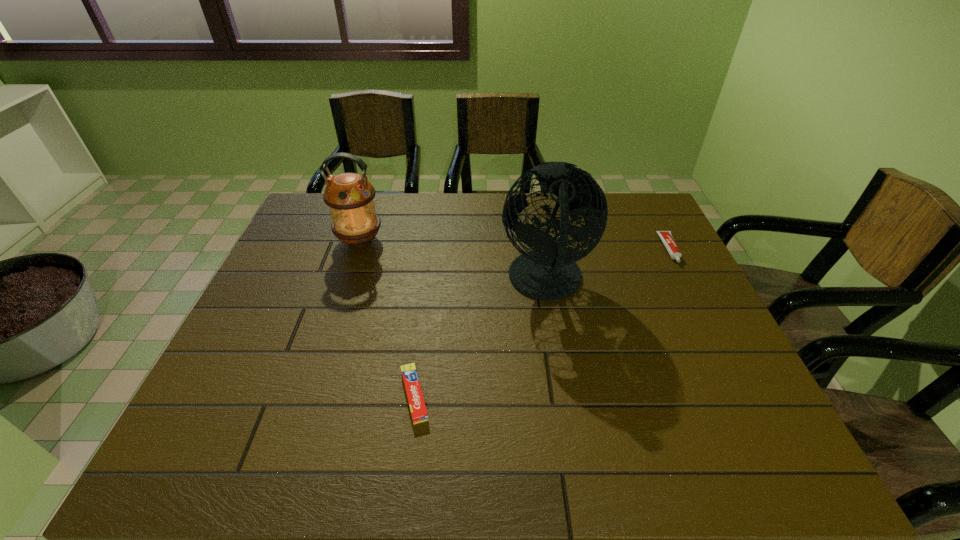
The height and width of the screenshot is (540, 960). What are the coordinates of `globe` in the screenshot? It's located at (549, 272).

This screenshot has width=960, height=540. In order to click on the tallest object in this screenshot , I will do `click(549, 272)`.

At what (x,y) coordinates should I click in order to perform the action: click on oil lamp. Please return your answer as a coordinate pair (x, y). Looking at the image, I should click on tap(350, 196).

Where is `the second tallest object`? the second tallest object is located at coordinates (350, 196).

Locate an element on the screen. the right toothpaste is located at coordinates (666, 236).

Locate an element on the screen. This screenshot has width=960, height=540. the farther toothpaste is located at coordinates (666, 236).

In order to click on the nearer toothpaste in this screenshot , I will do `click(419, 414)`.

Locate an element on the screen. the shortest object is located at coordinates (419, 414).

Identify the location of free space located 0.280m on the front-facing side of the tallest object. point(399,282).

Identify the location of vacant position located 0.100m on the front-facing side of the tallest object. The width and height of the screenshot is (960, 540). (464, 282).